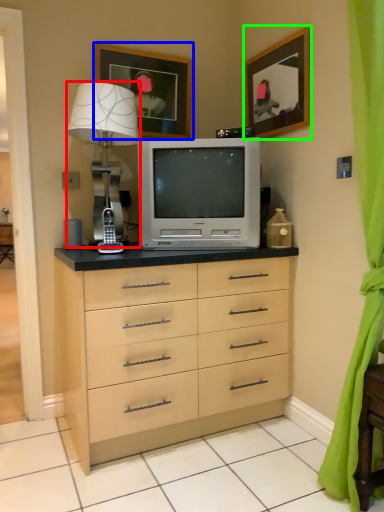
Question: Which object is the closest to the table lamp (highlighted by a red box)? Choose among these: picture frame (highlighted by a blue box) or picture frame (highlighted by a green box).

Choices:
 (A) picture frame
 (B) picture frame

Answer: (A)